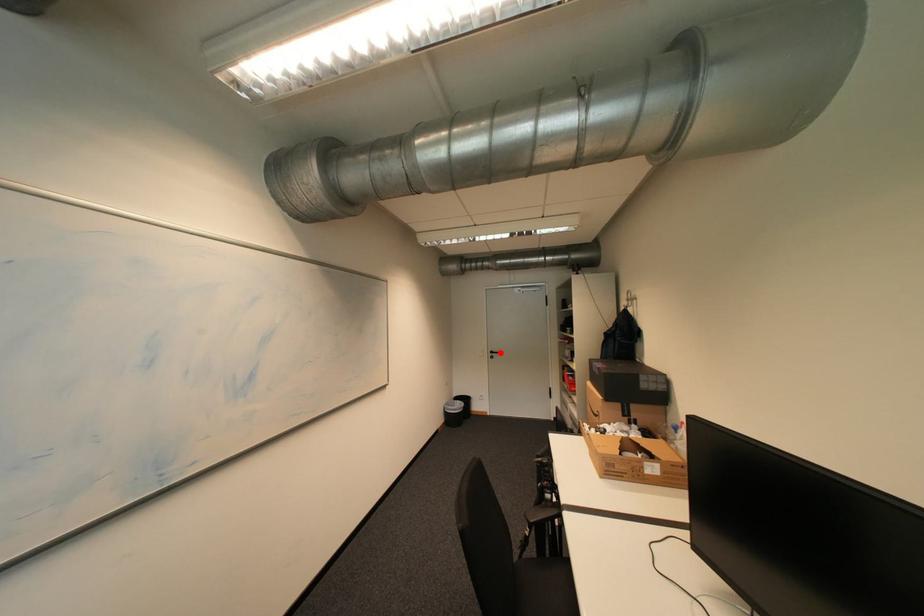
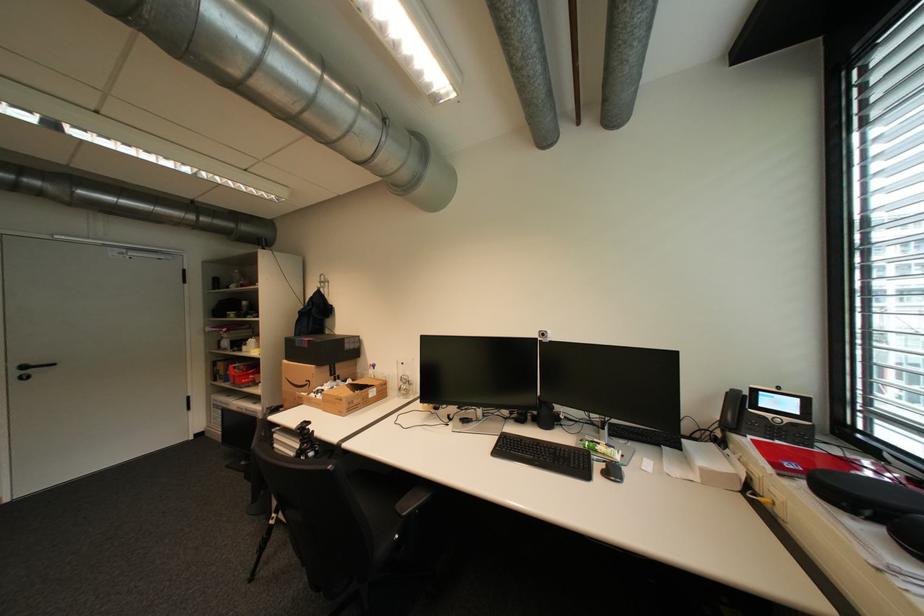
Where in the second image is the point corresponding to the highlighted location from the first image?

(32, 368)